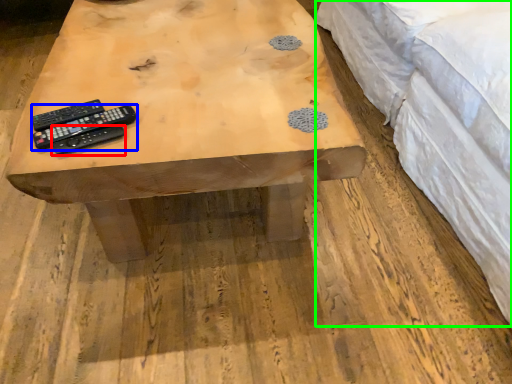
Question: Which is nearer to the remote control (highlighted by a red box)? remote control (highlighted by a blue box) or bed (highlighted by a green box).

Choices:
 (A) remote control
 (B) bed

Answer: (A)